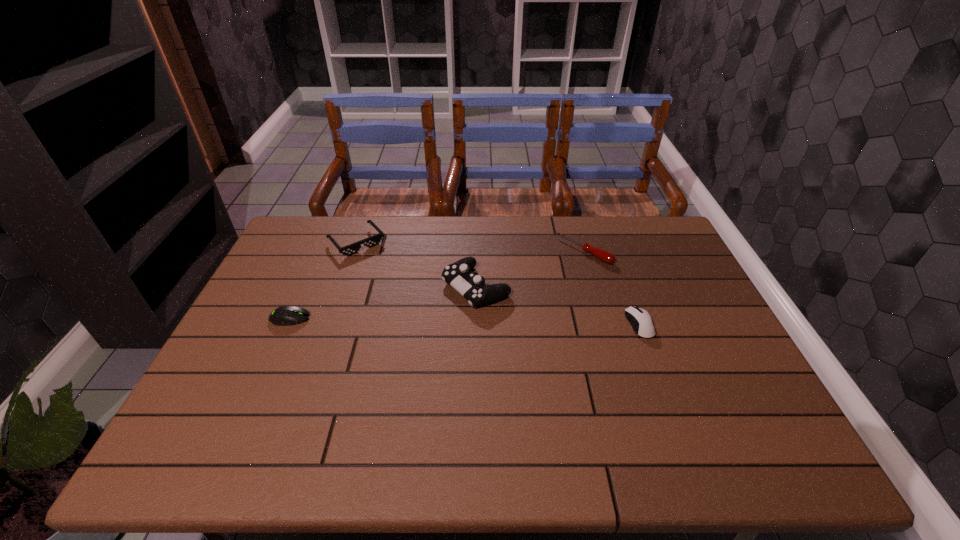
The width and height of the screenshot is (960, 540). I want to click on free location that satisfies the following two spatial constraints: 1. on the front side of the right mouse; 2. on the left side of the screwdriver, so click(x=606, y=325).

At what (x,y) coordinates should I click in order to perform the action: click on vacant region that satisfies the following two spatial constraints: 1. on the front side of the screwdriver; 2. on the left side of the sunglasses. Please return your answer as a coordinate pair (x, y). Image resolution: width=960 pixels, height=540 pixels. Looking at the image, I should click on (353, 251).